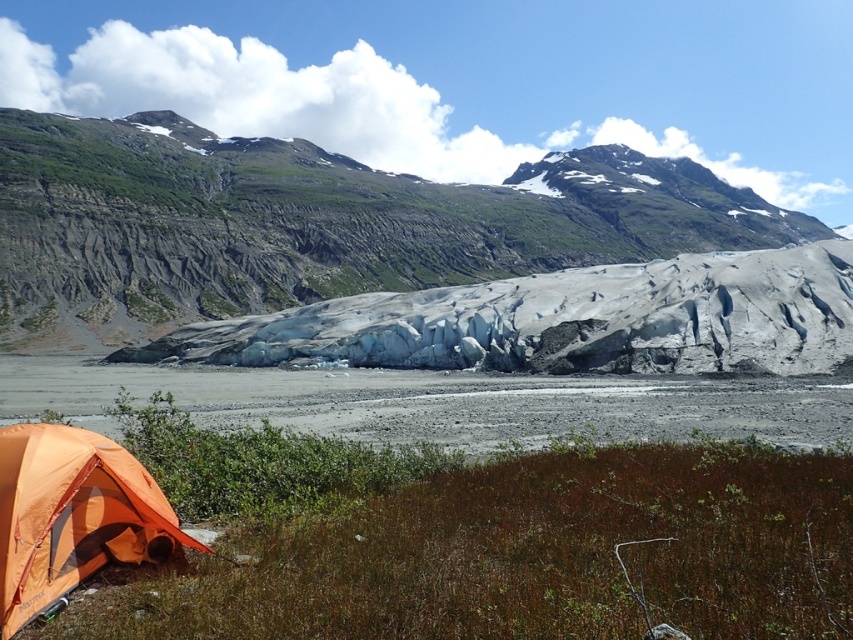
Question: Which point is farther to the camera?

Choices:
 (A) gray rocky mountain at center
 (B) gray/rocky glacier at center

Answer: (A)

Question: Which point is farther to the camera?

Choices:
 (A) orange fabric tent at lower left
 (B) gray/rocky glacier at center
 (C) gray rocky mountain at center

Answer: (C)

Question: Is gray rocky mountain at center below orange fabric tent at lower left?

Choices:
 (A) no
 (B) yes

Answer: (A)

Question: Does gray rocky mountain at center have a lesser width compared to orange fabric tent at lower left?

Choices:
 (A) yes
 (B) no

Answer: (B)

Question: Based on their relative distances, which object is farther from the orange fabric tent at lower left?

Choices:
 (A) gray rocky mountain at center
 (B) gray/rocky glacier at center

Answer: (A)

Question: Is gray/rocky glacier at center smaller than orange fabric tent at lower left?

Choices:
 (A) no
 (B) yes

Answer: (A)